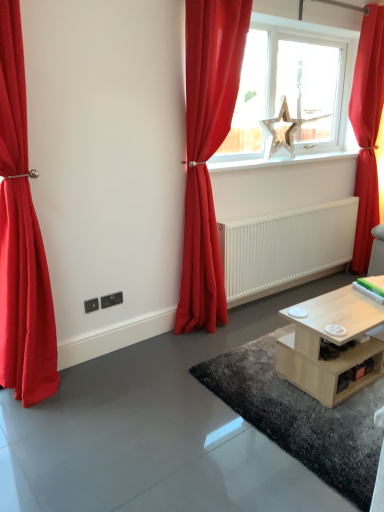
Image resolution: width=384 pixels, height=512 pixels. In order to click on free space above shiny wooden coffee table at lower center (from a real-world perspective) in this screenshot , I will do `click(303, 399)`.